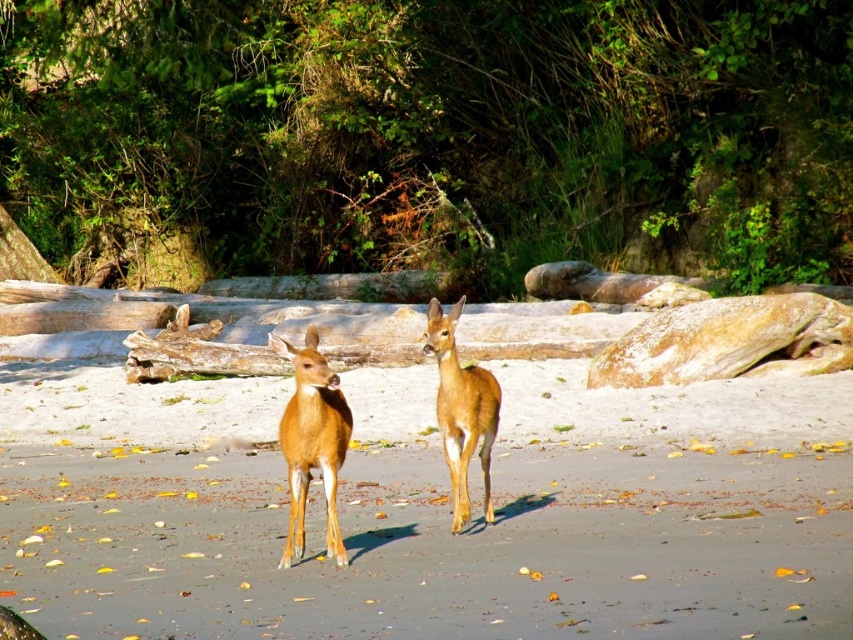
Who is positioned more to the left, shiny brown deer at center or brown matte/deer at center?

shiny brown deer at center

Who is more forward, [340,404] or [438,314]?

Point [340,404] is more forward.

Where is `shiny brown deer at center`? This screenshot has height=640, width=853. shiny brown deer at center is located at coordinates [312, 442].

Looking at this image, who is positioned more to the right, brown sandy beach at center or brown matte/deer at center?

From the viewer's perspective, brown sandy beach at center appears more on the right side.

Is brown sandy beach at center taller than brown matte/deer at center?

Incorrect, brown sandy beach at center's height is not larger of brown matte/deer at center's.

Does point (740, 579) come behind point (463, 508)?

No, (740, 579) is in front of (463, 508).

I want to click on brown sandy beach at center, so click(x=432, y=547).

What do you see at coordinates (432, 547) in the screenshot?
I see `brown sandy beach at center` at bounding box center [432, 547].

Who is more forward, (160, 621) or (305, 449)?

Positioned in front is point (160, 621).

You are a GUI agent. You are given a task and a screenshot of the screen. Output one action in this format:
    pyautogui.click(x=<x>, y=<y>)
    Task: Click on the brown sandy beach at center
    
    Given the screenshot: What is the action you would take?
    click(432, 547)